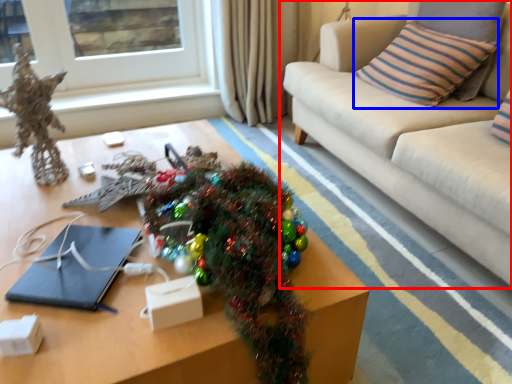
Question: Which point is closer to the camera, studio couch (highlighted by a red box) or pillow (highlighted by a blue box)?

Choices:
 (A) studio couch
 (B) pillow

Answer: (A)